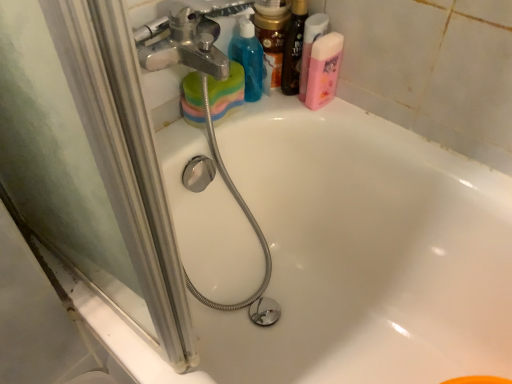
Question: Is shiny gold jar at upper center, which ranks as the first toiletry in left-to-right order, facing away from pink matte bottle at upper right, arranged as the 1th cleaning product when viewed from the right?

Choices:
 (A) yes
 (B) no

Answer: (B)

Question: Considering the relative positions of shiny gold jar at upper center, acting as the 2th toiletry starting from the right, and pink matte bottle at upper right, arranged as the 1th cleaning product when viewed from the right, in the image provided, is shiny gold jar at upper center, acting as the 2th toiletry starting from the right, to the left of pink matte bottle at upper right, arranged as the 1th cleaning product when viewed from the right, from the viewer's perspective?

Choices:
 (A) no
 (B) yes

Answer: (B)

Question: Is shiny gold jar at upper center, which ranks as the first toiletry in left-to-right order, next to pink matte bottle at upper right, arranged as the 1th cleaning product when viewed from the right, and touching it?

Choices:
 (A) no
 (B) yes

Answer: (A)

Question: Is shiny gold jar at upper center, acting as the 2th toiletry starting from the right, bigger than pink matte bottle at upper right, which appears as the second cleaning product when viewed from the left?

Choices:
 (A) no
 (B) yes

Answer: (B)

Question: From the image's perspective, is shiny gold jar at upper center, acting as the 2th toiletry starting from the right, over pink matte bottle at upper right, which appears as the second cleaning product when viewed from the left?

Choices:
 (A) no
 (B) yes

Answer: (B)

Question: From a real-world perspective, is shiny gold jar at upper center, acting as the 2th toiletry starting from the right, physically below pink matte bottle at upper right, which appears as the second cleaning product when viewed from the left?

Choices:
 (A) no
 (B) yes

Answer: (A)

Question: Considering the relative sizes of shiny black bottle at upper right, which is the second toiletry in left-to-right order, and white glossy bathtub at upper center in the image provided, is shiny black bottle at upper right, which is the second toiletry in left-to-right order, wider than white glossy bathtub at upper center?

Choices:
 (A) no
 (B) yes

Answer: (A)

Question: Is shiny black bottle at upper right, the 1th toiletry in the right-to-left sequence, positioned behind white glossy bathtub at upper center?

Choices:
 (A) yes
 (B) no

Answer: (A)

Question: Can you confirm if shiny black bottle at upper right, which is the second toiletry in left-to-right order, is bigger than white glossy bathtub at upper center?

Choices:
 (A) no
 (B) yes

Answer: (A)

Question: Does shiny black bottle at upper right, which is the second toiletry in left-to-right order, turn towards white glossy bathtub at upper center?

Choices:
 (A) yes
 (B) no

Answer: (B)

Question: Is shiny black bottle at upper right, the 1th toiletry in the right-to-left sequence, not inside white glossy bathtub at upper center?

Choices:
 (A) no
 (B) yes

Answer: (B)

Question: From the image's perspective, is shiny black bottle at upper right, the 1th toiletry in the right-to-left sequence, under white glossy bathtub at upper center?

Choices:
 (A) no
 (B) yes

Answer: (A)

Question: Is shiny gold jar at upper center, acting as the 2th toiletry starting from the right, located within pink matte bottle at upper right, which appears as the second cleaning product when viewed from the left?

Choices:
 (A) no
 (B) yes

Answer: (A)